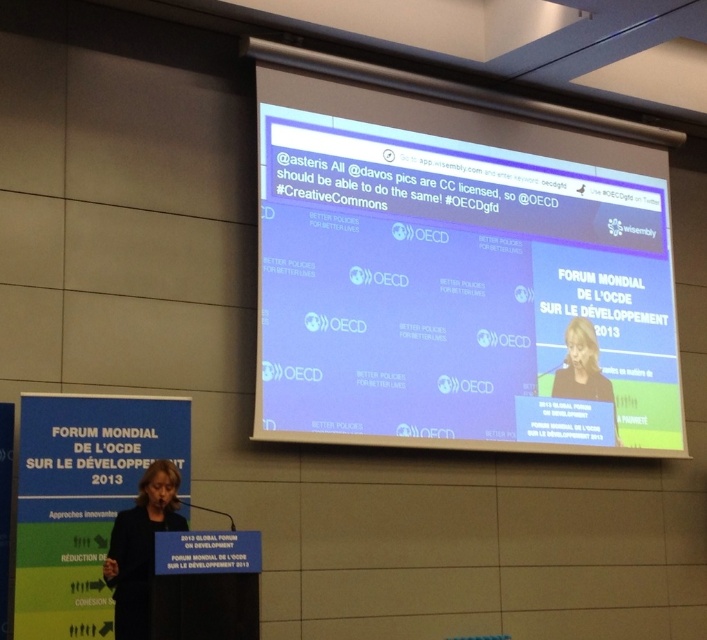
You are attending the OECD Global Forum on Development 2013 and notice the white matte projection screen at upper center and the dark gray suit at center. Which object appears taller in the image?

The white matte projection screen at upper center is much taller than the dark gray suit at center.

You are an event photographer at the OECD Global Forum on Development 2013. You need to capture a photo of the speaker wearing the dark gray suit at center and the dark blue fabric at center on the podium. Which object is shorter in height?

The dark blue fabric at center is not as tall as the dark gray suit at center, so the dark blue fabric at center is shorter in height.